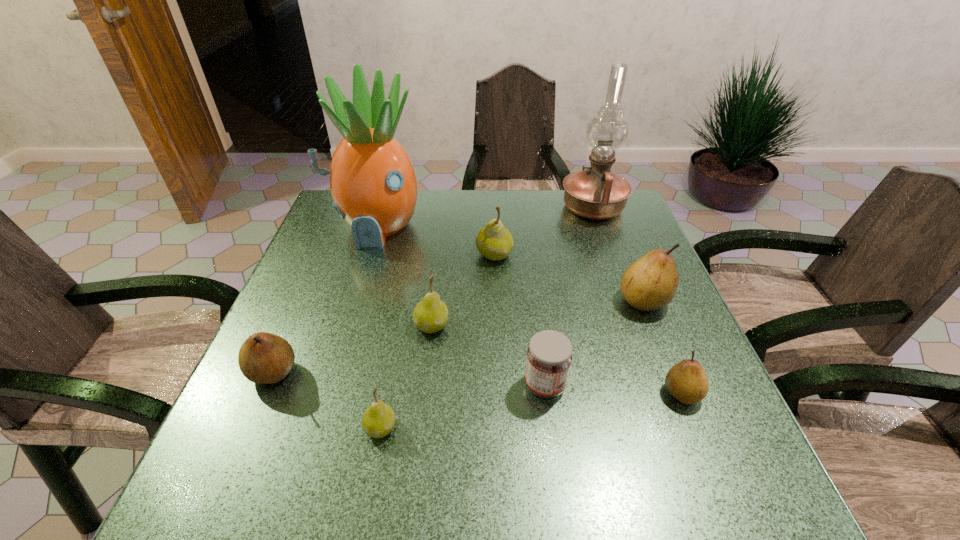
The width and height of the screenshot is (960, 540). In order to click on oil lamp in this screenshot , I will do `click(596, 193)`.

This screenshot has height=540, width=960. I want to click on pineapple, so click(372, 180).

I want to click on the farthest brown pear, so click(x=650, y=283).

The width and height of the screenshot is (960, 540). I want to click on the farthest green pear, so click(494, 241).

This screenshot has width=960, height=540. I want to click on the biggest green pear, so click(x=494, y=241).

You are a GUI agent. You are given a task and a screenshot of the screen. Output one action in this format:
    pyautogui.click(x=<x>, y=<y>)
    Task: Click on the fourth pear from right to left
    
    Given the screenshot: What is the action you would take?
    pyautogui.click(x=430, y=315)

The height and width of the screenshot is (540, 960). I want to click on the second green pear from right to left, so click(430, 315).

The height and width of the screenshot is (540, 960). I want to click on the leftmost pear, so click(264, 358).

You are a GUI agent. You are given a task and a screenshot of the screen. Output one action in this format:
    pyautogui.click(x=<x>, y=<y>)
    Task: Click on the leftmost brown pear
    The width and height of the screenshot is (960, 540).
    Given the screenshot: What is the action you would take?
    pyautogui.click(x=264, y=358)

Image resolution: width=960 pixels, height=540 pixels. Find the location of `jam`. jam is located at coordinates (549, 356).